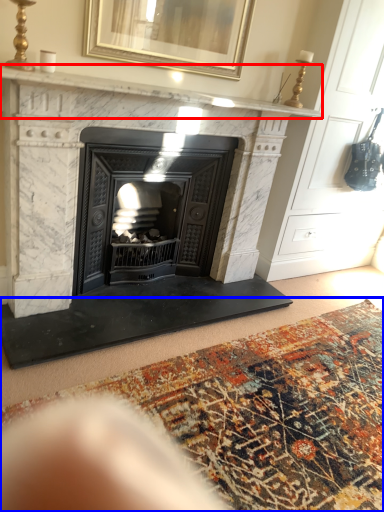
Question: Which object is further to the camera taking this photo, mantle (highlighted by a red box) or mat (highlighted by a blue box)?

Choices:
 (A) mantle
 (B) mat

Answer: (A)